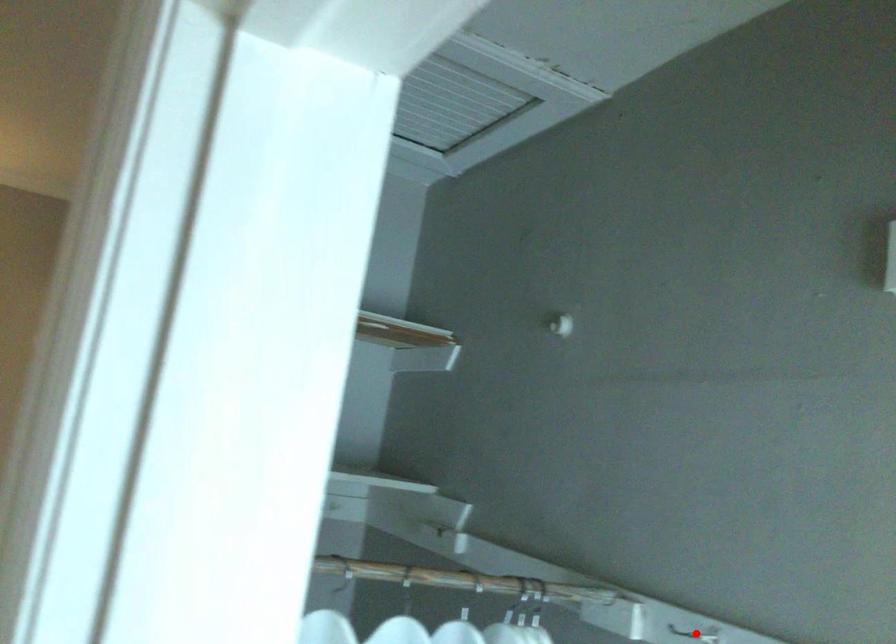
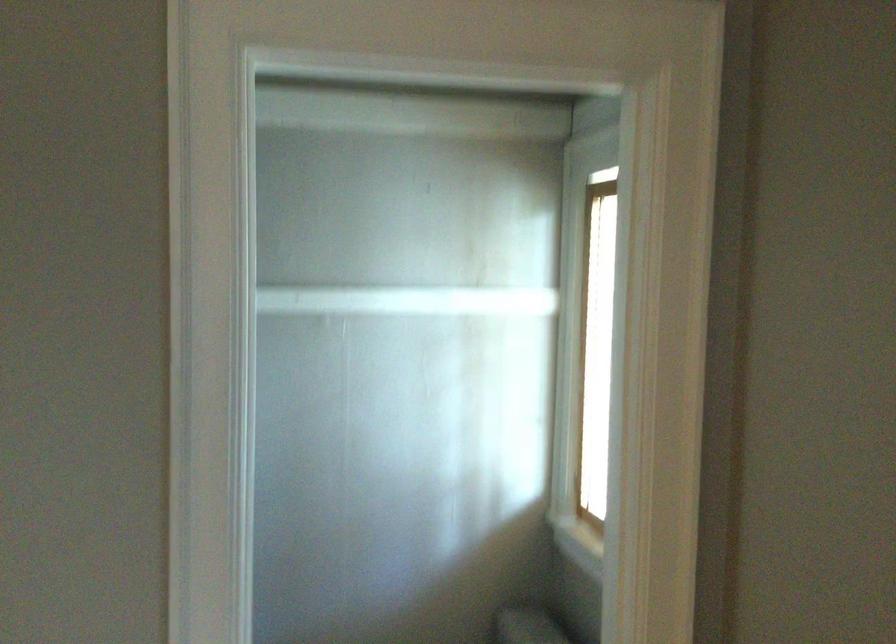
Question: I am providing you with two images of the same scene from different viewpoints. A red point is marked on the first image. At the location where the point appears in image 1, is it still visible in image 2?

Choices:
 (A) Yes
 (B) No

Answer: (B)